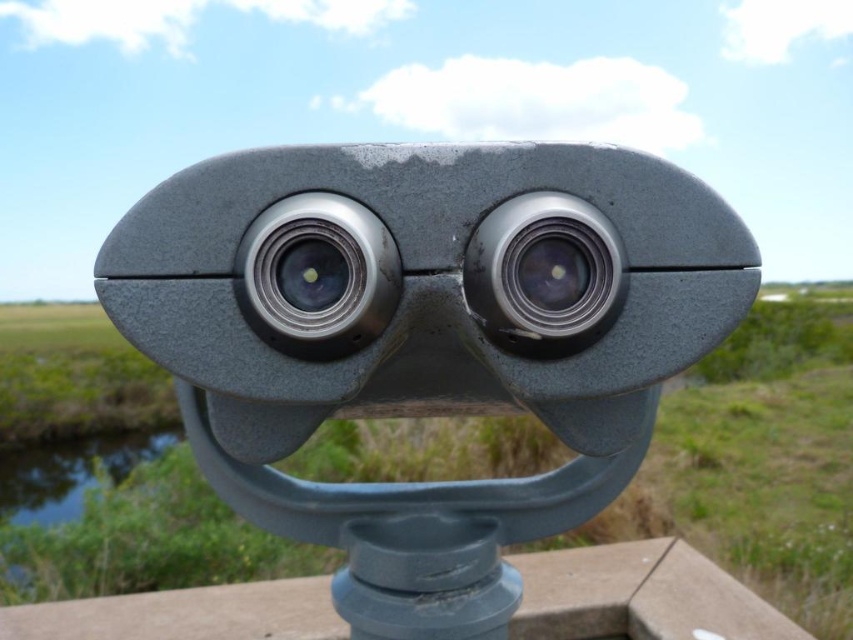
Question: Is matte gray telescope at center above satin silver lens at center?

Choices:
 (A) no
 (B) yes

Answer: (A)

Question: Which point is closer to the camera taking this photo?

Choices:
 (A) (445, 627)
 (B) (280, 305)
 (C) (524, 260)

Answer: (B)

Question: Is matte gray telescope at center positioned in front of satin silver lens at center?

Choices:
 (A) yes
 (B) no

Answer: (A)

Question: Which point is farther to the camera?

Choices:
 (A) (281, 166)
 (B) (343, 244)
 (C) (527, 193)

Answer: (A)

Question: Is metallic silver lens at center smaller than satin silver lens at center?

Choices:
 (A) no
 (B) yes

Answer: (A)

Question: Among these points, which one is farthest from the camera?

Choices:
 (A) (305, 330)
 (B) (508, 268)
 (C) (318, 404)

Answer: (C)